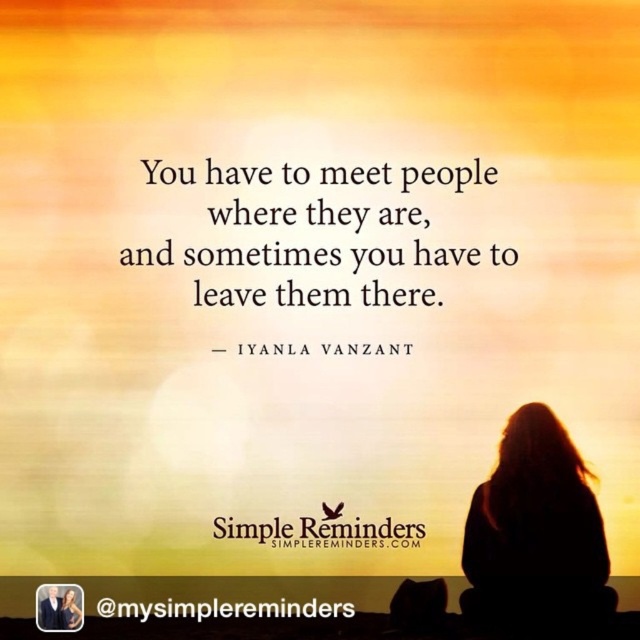
Question: Among these objects, which one is nearest to the camera?

Choices:
 (A) goldmetallictext at upper center
 (B) black text at center
 (C) black suit at lower left

Answer: (B)

Question: Considering the relative positions of black text at center and silky black hair at upper right in the image provided, where is black text at center located with respect to silky black hair at upper right?

Choices:
 (A) left
 (B) right

Answer: (B)

Question: Which of these objects is positioned farthest from the silky black hair at upper right?

Choices:
 (A) goldmetallictext at upper center
 (B) black paper at center
 (C) black suit at lower left
 (D) black text at center

Answer: (B)

Question: Does goldmetallictext at upper center come in front of black suit at lower left?

Choices:
 (A) yes
 (B) no

Answer: (A)

Question: Which of these objects is positioned closest to the silhouette hair at right?

Choices:
 (A) black text at center
 (B) silky black hair at upper right

Answer: (A)

Question: Is black text at center thinner than silky black hair at upper right?

Choices:
 (A) no
 (B) yes

Answer: (A)